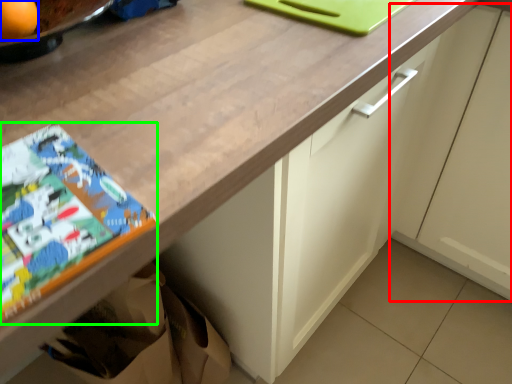
Question: Considering the real-world distances, which object is farthest from cabinetry (highlighted by a red box)? orange (highlighted by a blue box) or comic book (highlighted by a green box)?

Choices:
 (A) orange
 (B) comic book

Answer: (A)